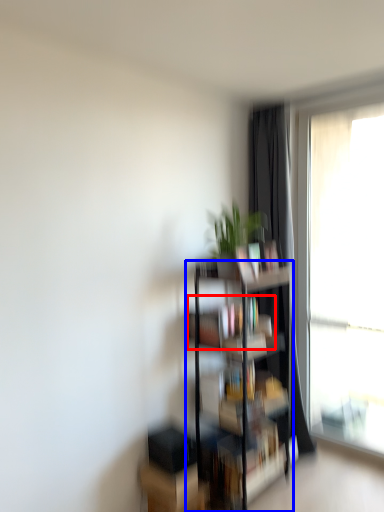
Question: Which point is further to the camera, book (highlighted by a red box) or shelf (highlighted by a blue box)?

Choices:
 (A) book
 (B) shelf

Answer: (A)